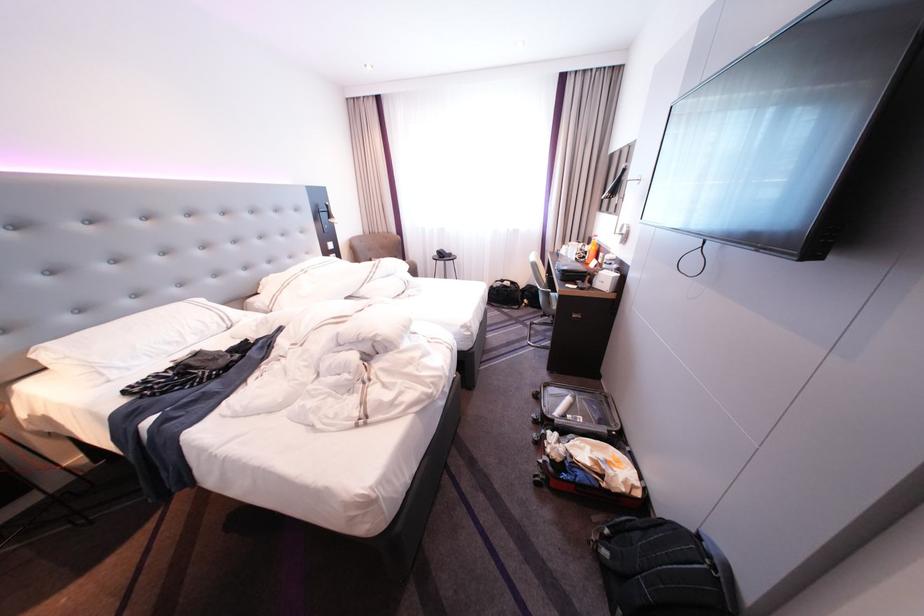
What do you see at coordinates (711, 554) in the screenshot?
I see `the backpack top handle` at bounding box center [711, 554].